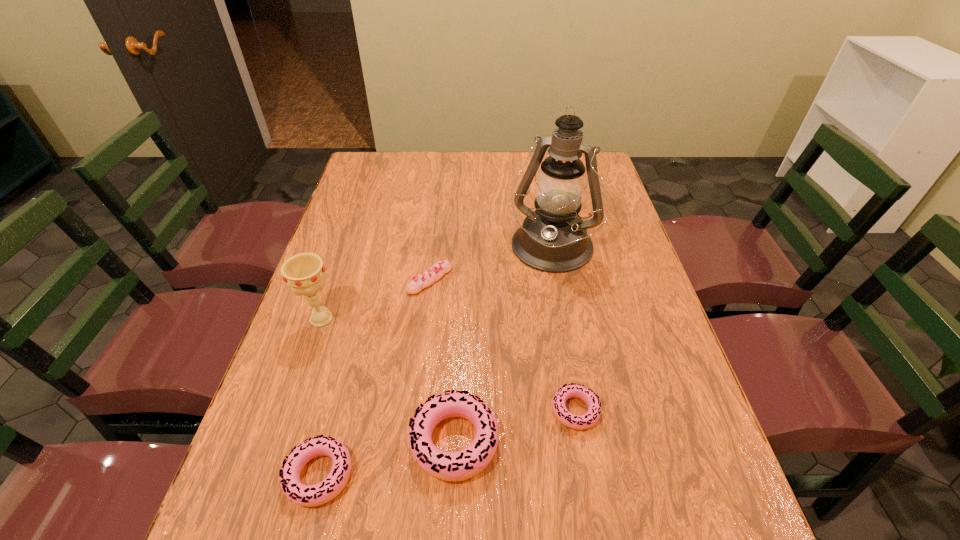
Please point a free position for a doughnut on the right. Please provide its 2D coordinates. Your answer should be formatted as a tuple, i.e. [(x, y)], where the tuple contains the x and y coordinates of a point satisfying the conditions above.

[(684, 383)]